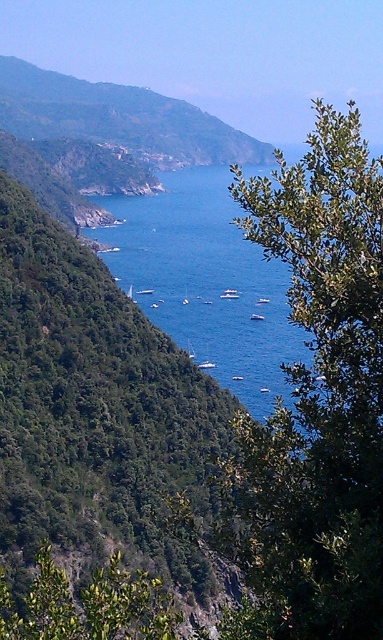
Which of these two, green leafy hillside at upper left or green leafy tree at lower left, stands shorter?

Result: green leafy tree at lower left is shorter.

Which is more to the right, green leafy hillside at upper left or green leafy tree at lower left?

From the viewer's perspective, green leafy tree at lower left appears more on the right side.

Does point (73, 83) lie behind point (85, 595)?

That is True.

Locate an element on the screen. The image size is (383, 640). green leafy hillside at upper left is located at coordinates (119, 118).

Can you confirm if green leafy tree at right is positioned below blue water at center?

Yes, green leafy tree at right is below blue water at center.

Does green leafy tree at right appear on the left side of blue water at center?

In fact, green leafy tree at right is to the right of blue water at center.

Is point (266, 220) positioned before point (145, 209)?

Yes, point (266, 220) is in front of point (145, 209).

This screenshot has height=640, width=383. Find the location of `green leafy tree at right`. green leafy tree at right is located at coordinates (317, 401).

Is green leafy tree at lower left smaller than white glossy boat at center?

Incorrect, green leafy tree at lower left is not smaller in size than white glossy boat at center.

Who is shorter, green leafy tree at lower left or white glossy boat at center?

white glossy boat at center

Where is `green leafy tree at lower left`? green leafy tree at lower left is located at coordinates (90, 605).

Find the location of a particular element. The image size is (383, 640). green leafy tree at lower left is located at coordinates (90, 605).